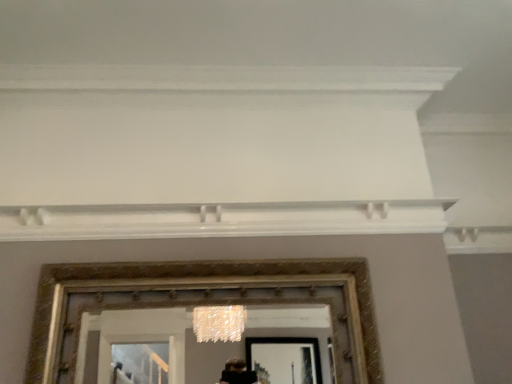
I want to click on gold textured picture frame at center, so click(203, 303).

Describe the element at coordinates (203, 303) in the screenshot. I see `gold textured picture frame at center` at that location.

Where is `gold textured picture frame at center`? This screenshot has width=512, height=384. gold textured picture frame at center is located at coordinates (203, 303).